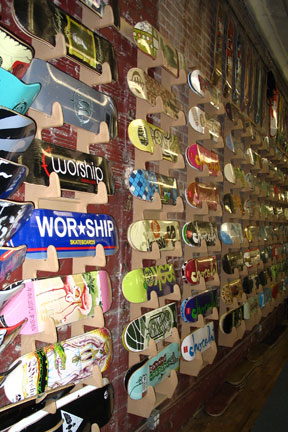
Where is `grey floor`? The width and height of the screenshot is (288, 432). grey floor is located at coordinates (284, 390), (277, 416).